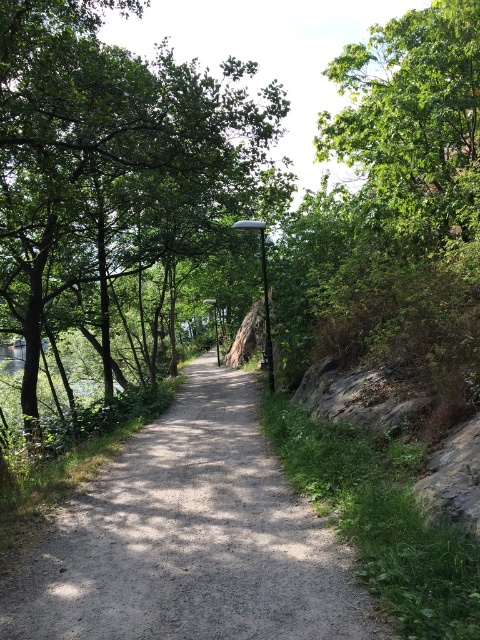
You are standing on the pathway and want to take a photo of both the green leafy tree at upper left and the green leafy tree at upper right. Which tree should you position yourself closer to in order to capture both in a single frame?

You should position yourself closer to the green leafy tree at upper right because the green leafy tree at upper left is located above it, allowing both to be captured in the frame when closer to the lower positioned tree.